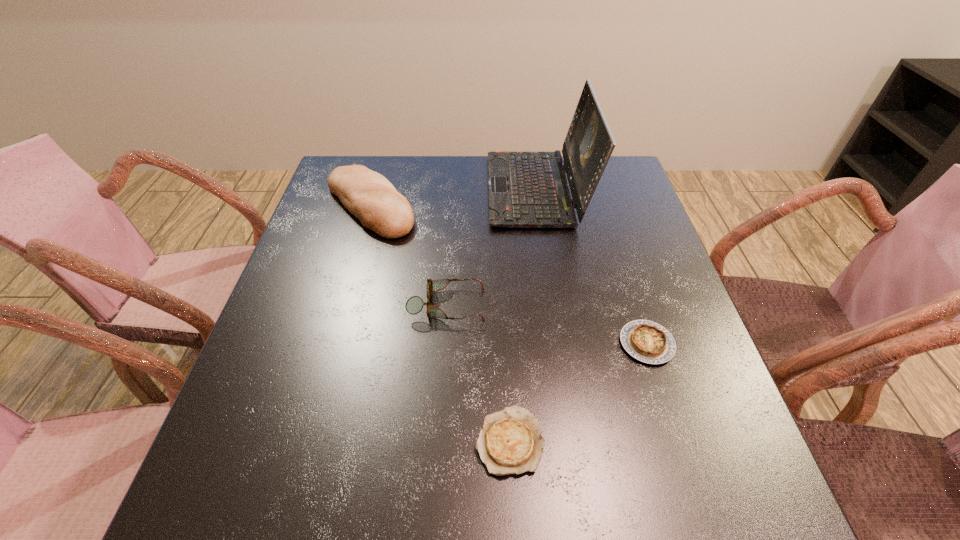
Locate an element on the screen. The height and width of the screenshot is (540, 960). vacant space positioned on the screen of the tallest object is located at coordinates (390, 190).

What are the coordinates of `vacant space located on the front of the leftmost object` in the screenshot? It's located at (320, 382).

Locate an element on the screen. This screenshot has height=540, width=960. vacant space situated 0.070m on the front-facing side of the third shortest object is located at coordinates (516, 305).

Where is `vacant space situated on the left of the taller quiche`? The height and width of the screenshot is (540, 960). vacant space situated on the left of the taller quiche is located at coordinates (545, 343).

Where is `free space located on the left of the shorter quiche`? The image size is (960, 540). free space located on the left of the shorter quiche is located at coordinates (317, 441).

Where is `laptop computer situated at the far edge`? Image resolution: width=960 pixels, height=540 pixels. laptop computer situated at the far edge is located at coordinates (526, 189).

Find the location of a particular element. This screenshot has height=540, width=960. bread that is at the far edge is located at coordinates (369, 196).

At what (x,y) coordinates should I click in order to perform the action: click on object that is at the near edge. Please return your answer as a coordinate pair (x, y). The height and width of the screenshot is (540, 960). Looking at the image, I should click on (510, 442).

This screenshot has height=540, width=960. Find the location of `object that is at the left edge`. object that is at the left edge is located at coordinates (369, 196).

Locate an element on the screen. The image size is (960, 540). laptop computer that is at the right edge is located at coordinates 526,189.